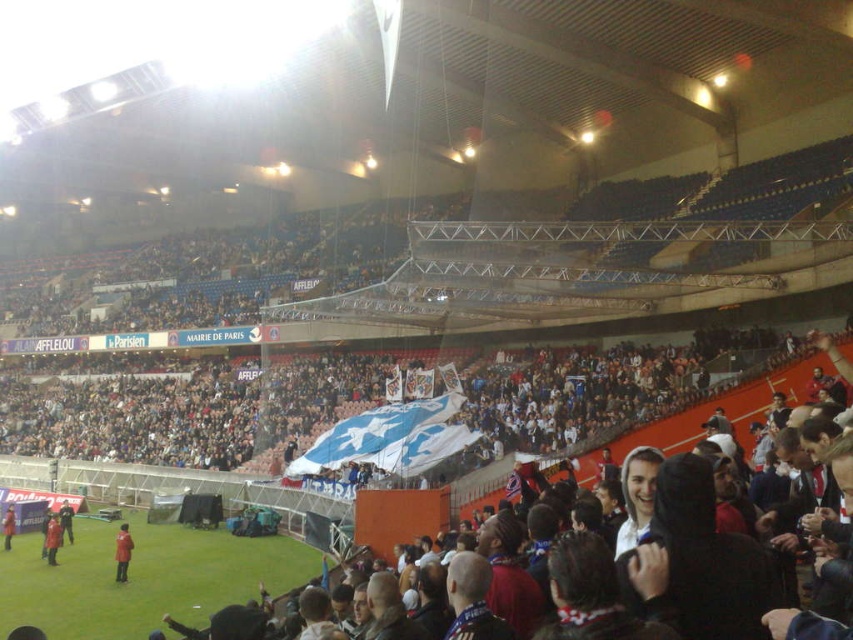
Who is positioned more to the right, red matte jacket at lower left or red jacket at lower left?

From the viewer's perspective, red matte jacket at lower left appears more on the right side.

Is red matte jacket at lower left in front of red jacket at lower left?

That is True.

Find the location of a particular element. red matte jacket at lower left is located at coordinates (51, 538).

Locate an element on the screen. red matte jacket at lower left is located at coordinates (51, 538).

Who is positioned more to the left, red fabric jacket at lower left or dark red jacket at lower left?

dark red jacket at lower left is more to the left.

Does point (125, 531) lie in front of point (70, 516)?

That is True.

You are a GUI agent. You are given a task and a screenshot of the screen. Output one action in this format:
    pyautogui.click(x=<x>, y=<y>)
    Task: Click on the red fabric jacket at lower left
    
    Given the screenshot: What is the action you would take?
    (122, 552)

Image resolution: width=853 pixels, height=640 pixels. I want to click on red matte jacket at lower left, so click(x=51, y=538).

In the scene shown: Does red matte jacket at lower left have a smaller size compared to dark red jacket at lower left?

Yes.

At what (x,y) coordinates should I click in order to perform the action: click on red matte jacket at lower left. Please return your answer as a coordinate pair (x, y). Looking at the image, I should click on (51, 538).